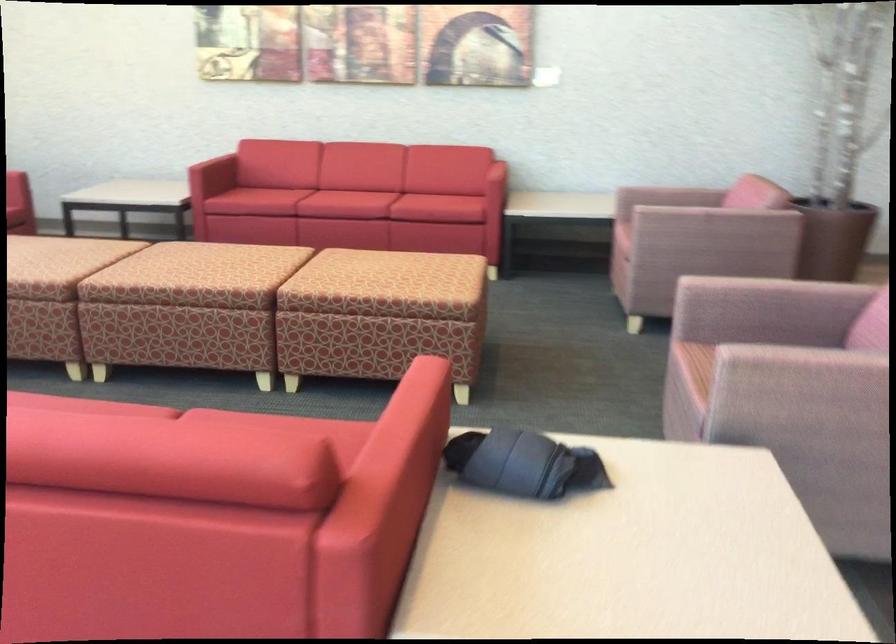
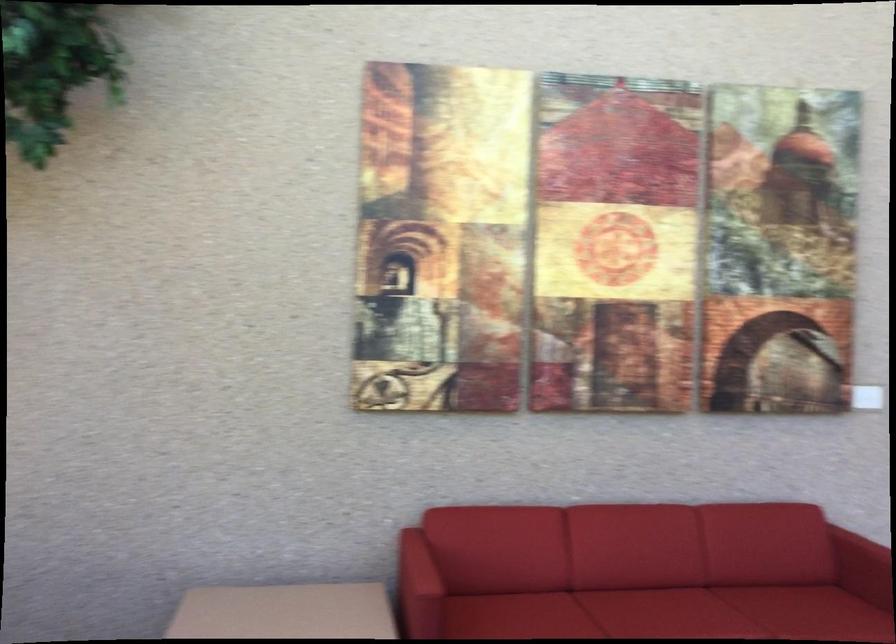
The point at (349, 175) is marked in the first image. Where is the corresponding point in the second image?

(659, 607)